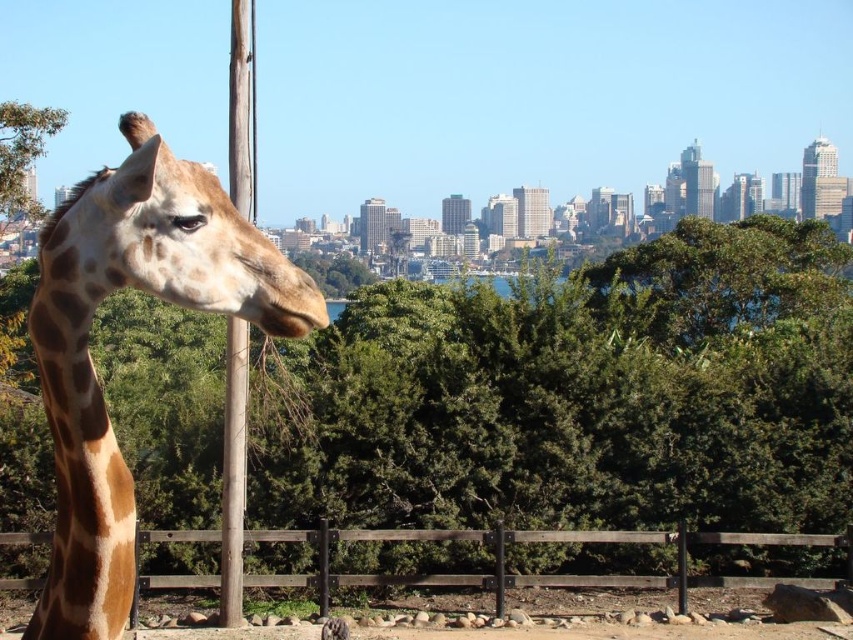
You are standing in a zoo and see the green leafy tree at center and the spotted fur giraffe at left. Which object is closer to the ground?

The green leafy tree at center is closer to the ground because it is located below the spotted fur giraffe at left.

You are standing in front of the giraffe and want to see the green leafy tree at center clearly. Which direction should you move to avoid the giraffe blocking your view?

To see the green leafy tree at center clearly, you should move to the right or left of the giraffe since the tree is located at point (577, 396), which is to the side of the giraffe in the midground.

Based on the photo, you are standing in front of the giraffe and want to place a small flag at one of the two points shown in the image. The first point is at coordinates point (672, 541) and the second is at point (236, 333). Which point is closer to you?

Point (672, 541) is closer to the viewer than point (236, 333) according to the description.